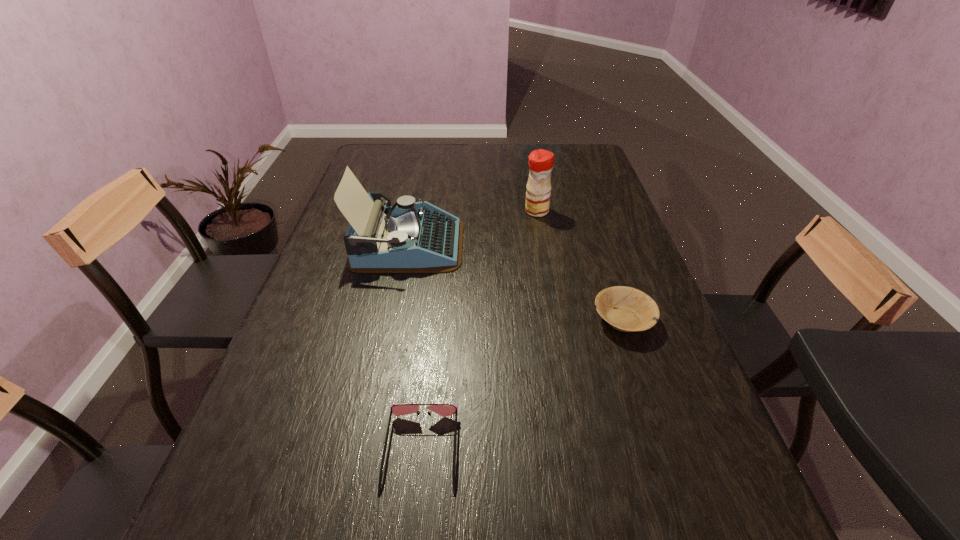
The width and height of the screenshot is (960, 540). I want to click on object that is at the right edge, so click(627, 309).

Find the location of a particular element. free space at the far edge of the desktop is located at coordinates (436, 156).

Image resolution: width=960 pixels, height=540 pixels. I want to click on blank area at the left edge, so click(323, 377).

You are a GUI agent. You are given a task and a screenshot of the screen. Output one action in this format:
    pyautogui.click(x=<x>, y=<y>)
    Task: Click on the free space at the right edge
    Image resolution: width=960 pixels, height=540 pixels.
    Given the screenshot: What is the action you would take?
    pyautogui.click(x=592, y=260)

Where is `vacant space at the far left corner of the desktop`? vacant space at the far left corner of the desktop is located at coordinates (370, 156).

The width and height of the screenshot is (960, 540). I want to click on vacant space that is in between the second farthest object and the sunglasses, so click(x=415, y=348).

The image size is (960, 540). I want to click on free space that is in between the sunglasses and the second farthest object, so click(x=415, y=348).

Where is `free space between the farthest object and the third farthest object`? This screenshot has height=540, width=960. free space between the farthest object and the third farthest object is located at coordinates (580, 265).

This screenshot has width=960, height=540. In order to click on vacant area between the third nearest object and the third farthest object in this screenshot , I will do click(516, 282).

The height and width of the screenshot is (540, 960). In order to click on free space between the nearest object and the typewriter in this screenshot , I will do `click(415, 348)`.